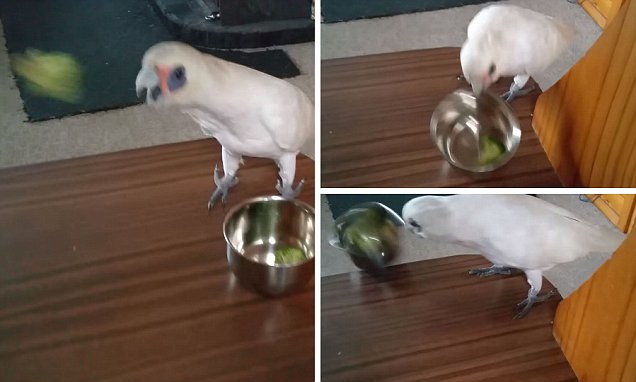
You are a GUI agent. You are given a task and a screenshot of the screen. Output one action in this format:
    pyautogui.click(x=<x>, y=<y>)
    Task: Click on the brown ledge
    This screenshot has height=382, width=636.
    Given the screenshot: What is the action you would take?
    pyautogui.click(x=621, y=308)